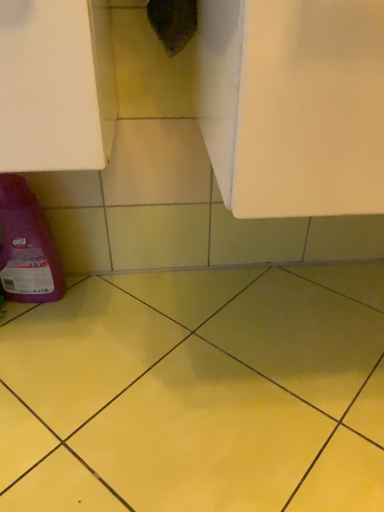
The width and height of the screenshot is (384, 512). What are the coordinates of `white matte cabinet at upper right` in the screenshot? It's located at (293, 104).

Describe the element at coordinates (293, 104) in the screenshot. I see `white matte cabinet at upper right` at that location.

Locate an element on the screen. white matte cabinet at upper right is located at coordinates (293, 104).